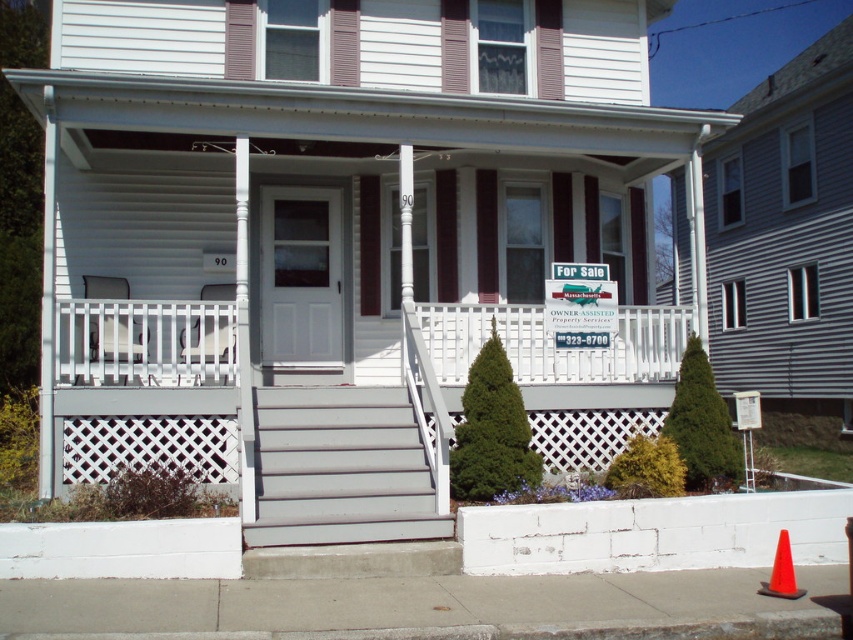
Question: Among these points, which one is nearest to the camera?

Choices:
 (A) (596, 305)
 (B) (763, 586)
 (C) (310, 502)

Answer: (B)

Question: Which object is farther from the camera taking this photo?

Choices:
 (A) white painted wood porch at center
 (B) white plastic sign at center
 (C) gray painted wood stairs at center
 (D) orange plastic traffic cone at lower right

Answer: (A)

Question: Is gray painted wood stairs at center closer to camera compared to white plastic sign at center?

Choices:
 (A) yes
 (B) no

Answer: (A)

Question: Which object appears farthest from the camera in this image?

Choices:
 (A) white plastic sign at center
 (B) white painted wood porch at center

Answer: (B)

Question: Does white painted wood porch at center lie in front of white plastic sign at center?

Choices:
 (A) no
 (B) yes

Answer: (A)

Question: Can you confirm if white plastic sign at center is positioned to the right of orange plastic traffic cone at lower right?

Choices:
 (A) yes
 (B) no

Answer: (B)